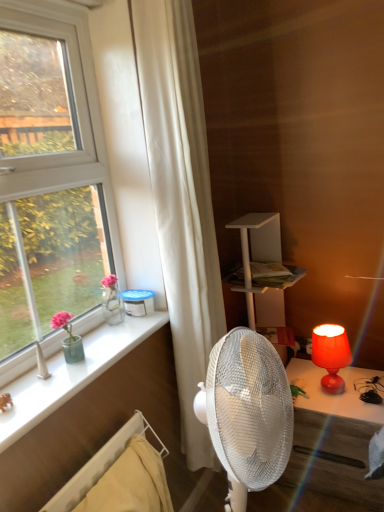
Question: Does white fabric curtain at center have a greater width compared to matte red lamp at right?

Choices:
 (A) no
 (B) yes

Answer: (A)

Question: Is white fabric curtain at center thinner than matte red lamp at right?

Choices:
 (A) no
 (B) yes

Answer: (B)

Question: Is white fabric curtain at center surrounding matte red lamp at right?

Choices:
 (A) no
 (B) yes

Answer: (A)

Question: Considering the relative positions of white fabric curtain at center and matte red lamp at right in the image provided, is white fabric curtain at center to the right of matte red lamp at right from the viewer's perspective?

Choices:
 (A) yes
 (B) no

Answer: (B)

Question: Is white fabric curtain at center in front of matte red lamp at right?

Choices:
 (A) yes
 (B) no

Answer: (A)

Question: Is white fabric curtain at center looking in the opposite direction of matte red lamp at right?

Choices:
 (A) yes
 (B) no

Answer: (B)

Question: Does matte red lamp at right appear on the right side of white glossy window sill at lower left?

Choices:
 (A) yes
 (B) no

Answer: (A)

Question: Can you confirm if matte red lamp at right is positioned to the left of white glossy window sill at lower left?

Choices:
 (A) yes
 (B) no

Answer: (B)

Question: Does matte red lamp at right come behind white glossy window sill at lower left?

Choices:
 (A) yes
 (B) no

Answer: (A)

Question: Is matte red lamp at right not near white glossy window sill at lower left?

Choices:
 (A) yes
 (B) no

Answer: (B)

Question: From the image's perspective, would you say matte red lamp at right is shown under white glossy window sill at lower left?

Choices:
 (A) no
 (B) yes

Answer: (B)

Question: Is matte red lamp at right closer to the viewer compared to white glossy window sill at lower left?

Choices:
 (A) yes
 (B) no

Answer: (B)

Question: Considering the relative positions of matte red lamp at right and white fabric curtain at center in the image provided, is matte red lamp at right behind white fabric curtain at center?

Choices:
 (A) yes
 (B) no

Answer: (A)